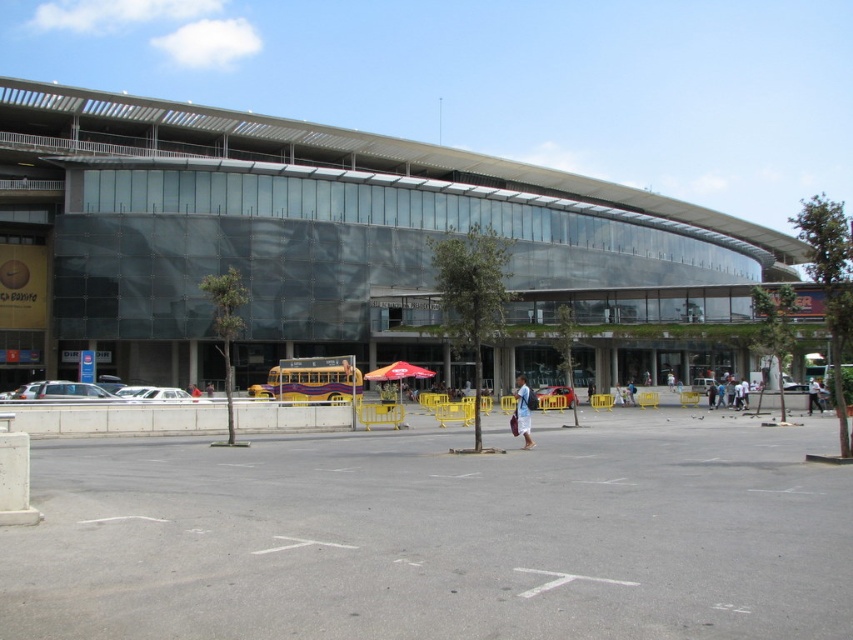
You are standing in the parking lot and see the transparent glass building at center and the white fabric bag at center. Which object is higher from the ground?

The transparent glass building at center is located above the white fabric bag at center, so the transparent glass building at center is higher from the ground.

You are standing in the parking lot of the modern building and notice a white fabric bag at center. If you want to place the bag next to the transparent glass building at center, will the bag fit comfortably without touching the building?

The transparent glass building at center is wider than the white fabric bag at center. Since the building is larger in width, there should be enough space to place the bag next to it without touching the building.

You are a delivery driver arriving at the building. You need to park your vehicle in the gray asphalt parking lot at center. Which side of the transparent glass building at center should you approach from to access the parking area?

You should approach from the left side of the transparent glass building at center because the gray asphalt parking lot at center is located to the left of the building.